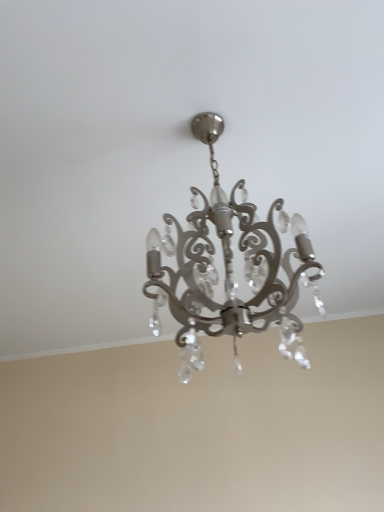
Locate an element on the screen. This screenshot has width=384, height=512. matte silver chandelier at center is located at coordinates (228, 267).

Describe the element at coordinates (228, 267) in the screenshot. I see `matte silver chandelier at center` at that location.

From the picture: Measure the distance between point (178,307) and camera.

A distance of 35.87 inches exists between point (178,307) and camera.

Find the location of a particular element. The height and width of the screenshot is (512, 384). matte silver chandelier at center is located at coordinates (228, 267).